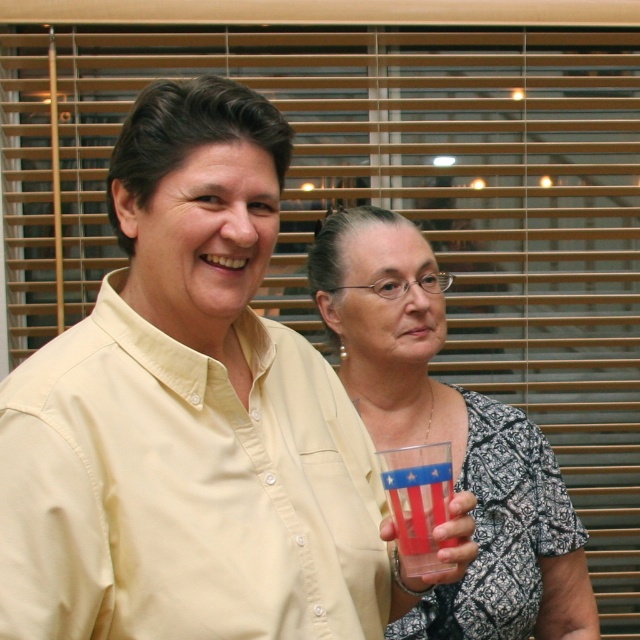
Question: Can you confirm if translucent plastic cup at center is thinner than translucent plastic cup at lower center?

Choices:
 (A) no
 (B) yes

Answer: (A)

Question: Is translucent plastic cup at center positioned before translucent plastic cup at lower center?

Choices:
 (A) yes
 (B) no

Answer: (B)

Question: Which point appears closest to the camera in this image?

Choices:
 (A) (435, 304)
 (B) (406, 483)

Answer: (B)

Question: Which of the following is the farthest from the observer?

Choices:
 (A) translucent plastic cup at center
 (B) translucent plastic cup at lower center

Answer: (A)

Question: Can you confirm if translucent plastic cup at center is wider than translucent plastic cup at lower center?

Choices:
 (A) no
 (B) yes

Answer: (B)